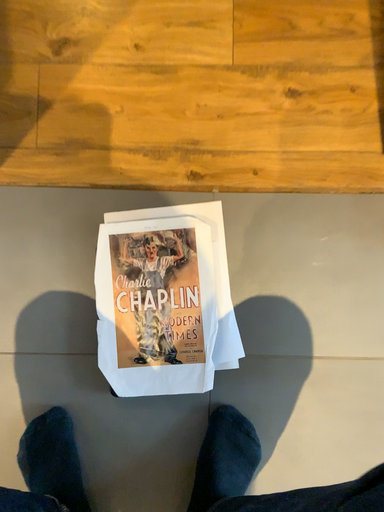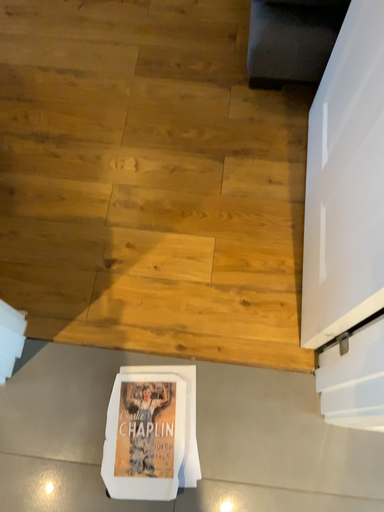
Question: How did the camera likely rotate when shooting the video?

Choices:
 (A) rotated downward
 (B) rotated upward

Answer: (B)